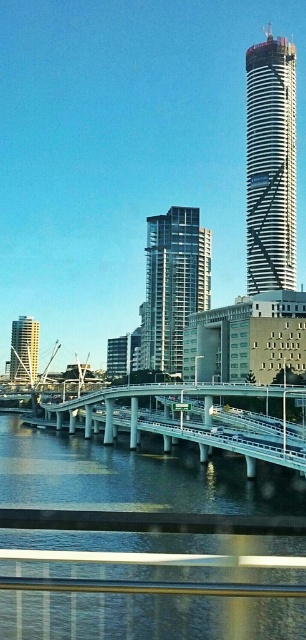
Question: Considering the real-world distances, which object is farthest from the white concrete bridge at center?

Choices:
 (A) clear water at bridge lower
 (B) silver metallic tower at center
 (C) matte glass skyscraper at left

Answer: (C)

Question: Based on their relative distances, which object is nearer to the glassy steel building at center?

Choices:
 (A) silver metallic tower at center
 (B) clear water at bridge lower

Answer: (A)

Question: Which point appears closest to the camera in this image?

Choices:
 (A) (284, 168)
 (B) (290, 388)
 (C) (167, 328)
 (D) (159, 637)

Answer: (D)

Question: Is clear water at bridge lower smaller than white concrete bridge at center?

Choices:
 (A) yes
 (B) no

Answer: (B)

Question: Does glassy steel building at center have a lesser width compared to matte glass skyscraper at left?

Choices:
 (A) no
 (B) yes

Answer: (A)

Question: From the image, what is the correct spatial relationship of white concrete bridge at center in relation to matte glass skyscraper at left?

Choices:
 (A) right
 (B) left

Answer: (A)